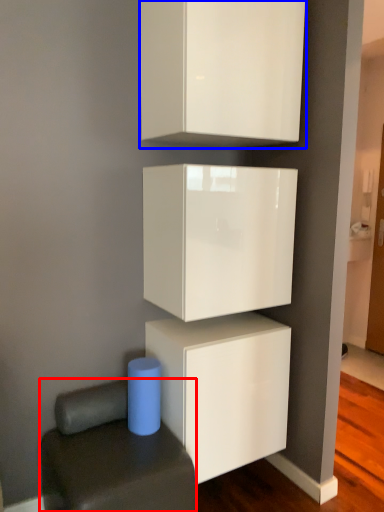
Question: Which object appears farthest to the camera in this image, furniture (highlighted by a red box) or cabinetry (highlighted by a blue box)?

Choices:
 (A) furniture
 (B) cabinetry

Answer: (B)